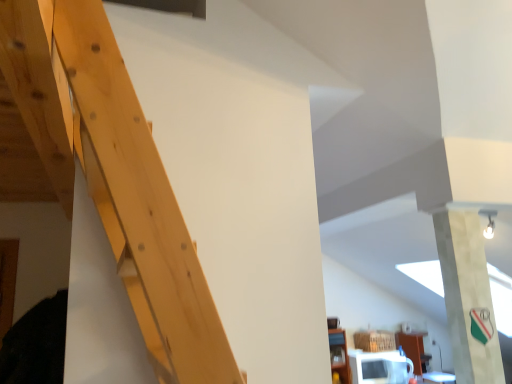
You are a GUI agent. You are given a task and a screenshot of the screen. Output one action in this format:
    pyautogui.click(x=<x>, y=<y>)
    Task: Click on the white glossy microwave at lower right
    Image resolution: width=512 pixels, height=384 pixels.
    Given the screenshot: What is the action you would take?
    pyautogui.click(x=380, y=367)

Describe the element at coordinates (380, 367) in the screenshot. I see `white glossy microwave at lower right` at that location.

What are the coordinates of `white fabric banner at upper right` in the screenshot? It's located at (467, 296).

What is the approximate width of white fabric banner at upper right?

white fabric banner at upper right is 7.71 inches wide.

This screenshot has height=384, width=512. What do you see at coordinates (467, 296) in the screenshot?
I see `white fabric banner at upper right` at bounding box center [467, 296].

Find the location of a particular element. white glossy microwave at lower right is located at coordinates (380, 367).

Between white fabric banner at upper right and white glossy microwave at lower right, which one appears on the left side from the viewer's perspective?

From the viewer's perspective, white fabric banner at upper right appears more on the left side.

Which object is further away from the camera, white fabric banner at upper right or white glossy microwave at lower right?

white glossy microwave at lower right.

Is point (471, 344) in front of point (406, 380)?

That is True.

From the image's perspective, which object appears higher, white fabric banner at upper right or white glossy microwave at lower right?

white fabric banner at upper right is shown above in the image.

From a real-world perspective, is white fabric banner at upper right physically below white glossy microwave at lower right?

No, from a real-world perspective, white fabric banner at upper right is not below white glossy microwave at lower right.

Does white fabric banner at upper right have a lesser width compared to white glossy microwave at lower right?

Indeed, white fabric banner at upper right has a lesser width compared to white glossy microwave at lower right.

Can you confirm if white fabric banner at upper right is taller than white glossy microwave at lower right?

Correct, white fabric banner at upper right is much taller as white glossy microwave at lower right.

Considering the sizes of objects white fabric banner at upper right and white glossy microwave at lower right in the image provided, who is smaller, white fabric banner at upper right or white glossy microwave at lower right?

Smaller between the two is white fabric banner at upper right.

Is white glossy microwave at lower right inside white fabric banner at upper right?

No, white glossy microwave at lower right is located outside of white fabric banner at upper right.

From the picture: Are white fabric banner at upper right and white glossy microwave at lower right beside each other?

No, white fabric banner at upper right is not touching white glossy microwave at lower right.

Is white fabric banner at upper right facing towards white glossy microwave at lower right?

No, white fabric banner at upper right is not oriented towards white glossy microwave at lower right.

Can you tell me how much white fabric banner at upper right and white glossy microwave at lower right differ in facing direction?

The angle between the facing direction of white fabric banner at upper right and the facing direction of white glossy microwave at lower right is 3.5 degrees.

At what (x,y) coordinates should I click in order to perform the action: click on pillar that is above the white glossy microwave at lower right (from a real-world perspective). Please return your answer as a coordinate pair (x, y). The width and height of the screenshot is (512, 384). Looking at the image, I should click on (467, 296).

Considering the positions of objects white glossy microwave at lower right and white fabric banner at upper right in the image provided, who is more to the right, white glossy microwave at lower right or white fabric banner at upper right?

white glossy microwave at lower right is more to the right.

Is white glossy microwave at lower right in front of or behind white fabric banner at upper right in the image?

In the image, white glossy microwave at lower right appears behind white fabric banner at upper right.

Is point (362, 362) positioned behind point (482, 285)?

That is True.

From the image's perspective, is white glossy microwave at lower right located above white fabric banner at upper right?

Incorrect, from the image's perspective, white glossy microwave at lower right is lower than white fabric banner at upper right.

From a real-world perspective, does white glossy microwave at lower right stand above white fabric banner at upper right?

Incorrect, from a real-world perspective, white glossy microwave at lower right is lower than white fabric banner at upper right.

Does white glossy microwave at lower right have a greater width compared to white fabric banner at upper right?

Yes, white glossy microwave at lower right is wider than white fabric banner at upper right.

Which of these two, white glossy microwave at lower right or white fabric banner at upper right, stands shorter?

With less height is white glossy microwave at lower right.

Consider the image. Who is smaller, white glossy microwave at lower right or white fabric banner at upper right?

With smaller size is white fabric banner at upper right.

Would you say white fabric banner at upper right is part of white glossy microwave at lower right's contents?

Actually, white fabric banner at upper right is outside white glossy microwave at lower right.

Is white glossy microwave at lower right touching white fabric banner at upper right?

white glossy microwave at lower right and white fabric banner at upper right are clearly separated.

Is white glossy microwave at lower right facing towards white fabric banner at upper right?

Yes, white glossy microwave at lower right is facing white fabric banner at upper right.

Where is `pillar located in front of the white glossy microwave at lower right`? This screenshot has height=384, width=512. pillar located in front of the white glossy microwave at lower right is located at coordinates (467, 296).

This screenshot has height=384, width=512. Identify the location of microwave that is below the white fabric banner at upper right (from the image's perspective). (380, 367).

The width and height of the screenshot is (512, 384). Identify the location of microwave on the right of the white fabric banner at upper right. (380, 367).